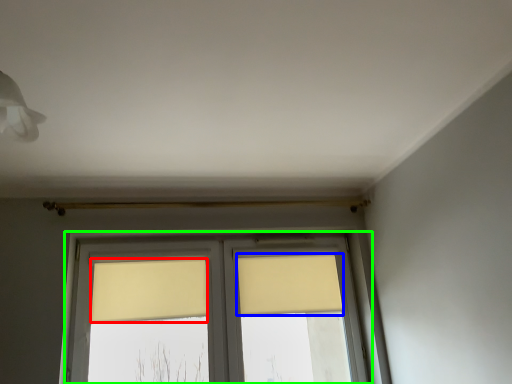
Question: Which is nearer to the curtain (highlighted by a red box)? curtain (highlighted by a blue box) or window (highlighted by a green box).

Choices:
 (A) curtain
 (B) window

Answer: (B)